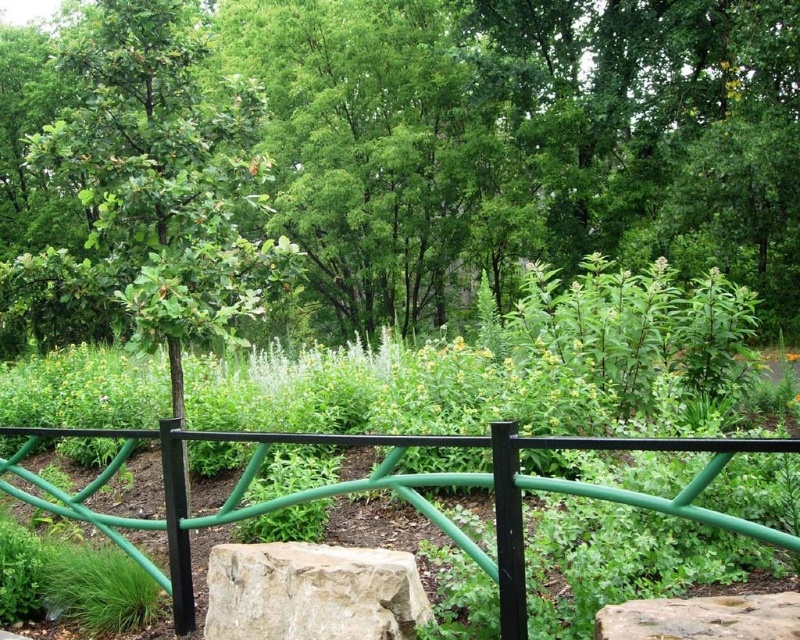
Who is positioned more to the left, beige rough stone boulder at center or smooth gray rock at lower right?

beige rough stone boulder at center

Is point (400, 614) positioned after point (698, 608)?

Yes, point (400, 614) is behind point (698, 608).

You are a GUI agent. You are given a task and a screenshot of the screen. Output one action in this format:
    pyautogui.click(x=<x>, y=<y>)
    Task: Click on the beige rough stone boulder at center
    
    Given the screenshot: What is the action you would take?
    pyautogui.click(x=312, y=593)

Is green leafy tree at center thinner than beige rough stone boulder at center?

No.

Is green leafy tree at center wider than beige rough stone boulder at center?

Yes, green leafy tree at center is wider than beige rough stone boulder at center.

This screenshot has height=640, width=800. Describe the element at coordinates (526, 140) in the screenshot. I see `green leafy tree at center` at that location.

The image size is (800, 640). I want to click on green leafy tree at center, so click(x=526, y=140).

Who is higher up, green painted metal fence at center or beige rough stone boulder at center?

green painted metal fence at center

Who is more forward, (366, 488) or (344, 547)?

Point (366, 488) is more forward.

The width and height of the screenshot is (800, 640). I want to click on green painted metal fence at center, so click(x=386, y=486).